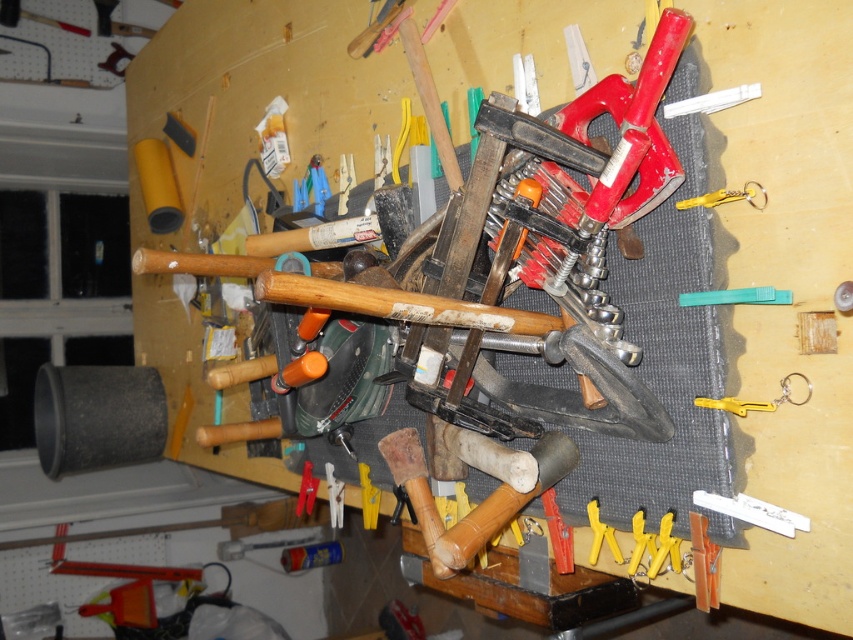
Question: Among these objects, which one is nearest to the camera?

Choices:
 (A) metallic red clamp at center
 (B) yellow plastic clamp at lower right
 (C) yellow plastic clamp at center
 (D) wooden hammer at center

Answer: (B)

Question: Observing the image, what is the correct spatial positioning of yellow plastic clip at right in reference to yellow plastic clamp at center?

Choices:
 (A) below
 (B) above

Answer: (B)

Question: Observing the image, what is the correct spatial positioning of yellow plastic clamps at lower center in reference to yellow plastic clamp at lower right?

Choices:
 (A) above
 (B) below

Answer: (A)

Question: Which of the following is the farthest from the observer?

Choices:
 (A) yellow plastic keychain at upper right
 (B) yellow plastic clamp at lower right

Answer: (B)

Question: Which object appears closest to the camera in this image?

Choices:
 (A) brushed metal hammer at upper left
 (B) yellow plastic clamps at lower center
 (C) yellow plastic clip at right
 (D) yellow plastic clamp at center

Answer: (C)

Question: Is the position of green plastic clip at center more distant than that of metallic red clamp at center?

Choices:
 (A) yes
 (B) no

Answer: (B)